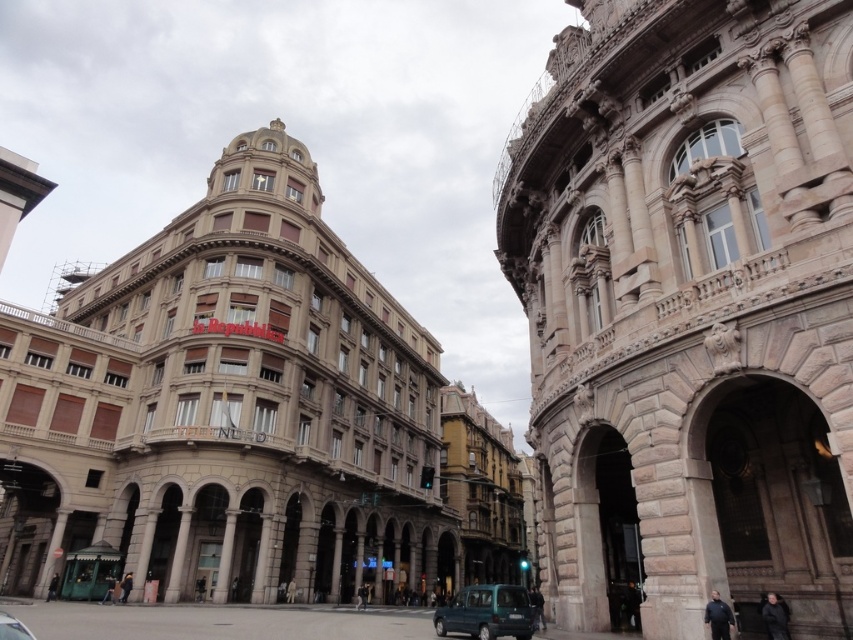
Does point (465, 609) come farther from viewer compared to point (16, 621)?

That is True.

Measure the distance between teal matte car at lower center and metallic silver car at lower left.

teal matte car at lower center and metallic silver car at lower left are 31.02 meters apart.

Which is in front, point (469, 596) or point (9, 616)?

Point (9, 616) is more forward.

Locate an element on the screen. teal matte car at lower center is located at coordinates (486, 612).